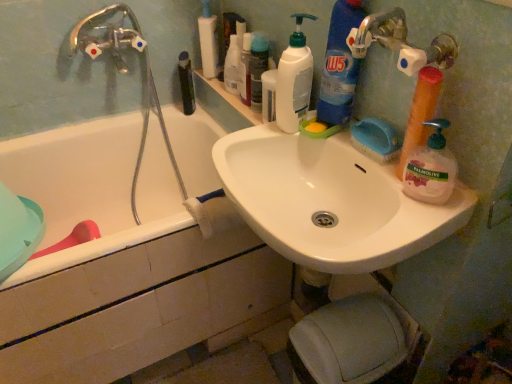
Question: In which direction should I rotate to look at translucent plastic soap dispenser at upper center, positioned as the second toiletry in left-to-right order?

Choices:
 (A) right
 (B) left

Answer: (B)

Question: From a real-world perspective, does green matte bottle at upper center sit lower than translucent plastic soap dispenser at upper center, the second toiletry from the right?

Choices:
 (A) no
 (B) yes

Answer: (B)

Question: Considering the relative positions of green matte bottle at upper center and translucent plastic soap dispenser at upper center, positioned as the second toiletry in left-to-right order, in the image provided, is green matte bottle at upper center in front of translucent plastic soap dispenser at upper center, positioned as the second toiletry in left-to-right order,?

Choices:
 (A) yes
 (B) no

Answer: (B)

Question: Is the depth of green matte bottle at upper center greater than that of translucent plastic soap dispenser at upper center, positioned as the second toiletry in left-to-right order?

Choices:
 (A) yes
 (B) no

Answer: (A)

Question: From a real-world perspective, is green matte bottle at upper center located higher than translucent plastic soap dispenser at upper center, the second toiletry from the right?

Choices:
 (A) no
 (B) yes

Answer: (A)

Question: Is green matte bottle at upper center to the left of translucent plastic soap dispenser at upper center, the second toiletry from the right, from the viewer's perspective?

Choices:
 (A) no
 (B) yes

Answer: (B)

Question: From the image's perspective, is green matte bottle at upper center over translucent plastic soap dispenser at upper center, the second toiletry from the right?

Choices:
 (A) no
 (B) yes

Answer: (A)

Question: Does white plastic pump bottle at upper center, the 3th toiletry viewed from the right, appear on the left side of translucent plastic bottle at upper center, the third toiletry in the left-to-right sequence?

Choices:
 (A) yes
 (B) no

Answer: (A)

Question: Does white plastic pump bottle at upper center, the 3th toiletry viewed from the right, have a greater height compared to translucent plastic bottle at upper center, the third toiletry in the left-to-right sequence?

Choices:
 (A) yes
 (B) no

Answer: (A)

Question: Is white plastic pump bottle at upper center, the first toiletry from the left, outside translucent plastic bottle at upper center, the third toiletry in the left-to-right sequence?

Choices:
 (A) yes
 (B) no

Answer: (A)

Question: Is white plastic pump bottle at upper center, the 3th toiletry viewed from the right, oriented towards translucent plastic bottle at upper center, the first toiletry positioned from the right?

Choices:
 (A) yes
 (B) no

Answer: (B)

Question: Considering the relative sizes of white plastic pump bottle at upper center, the first toiletry from the left, and translucent plastic bottle at upper center, the first toiletry positioned from the right, in the image provided, is white plastic pump bottle at upper center, the first toiletry from the left, shorter than translucent plastic bottle at upper center, the first toiletry positioned from the right,?

Choices:
 (A) yes
 (B) no

Answer: (B)

Question: From a real-world perspective, is white plastic pump bottle at upper center, the first toiletry from the left, below translucent plastic bottle at upper center, the third toiletry in the left-to-right sequence?

Choices:
 (A) no
 (B) yes

Answer: (A)

Question: Can you confirm if translucent orange sponge at right, placed as the second cleaning product when sorted from right to left, is wider than white plastic pump bottle at upper center, the 3th toiletry viewed from the right?

Choices:
 (A) no
 (B) yes

Answer: (A)